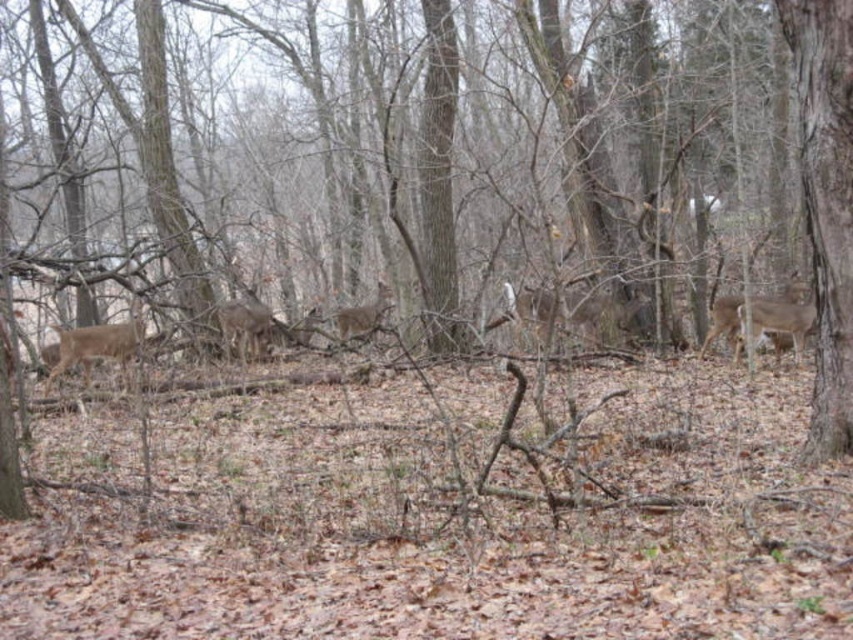
You are a hiker navigating through the wooded area and want to move from the starting point at point (x=850, y=68) to the destination at point (x=57, y=349). Based on the scene description, which direction should you head to reach your destination?

Point (x=850, y=68) is in front of point (x=57, y=349), so you should move backward to reach your destination.

You are a wildlife photographer aiming to capture both the brown fur deer at left and the brown fur deer at center in a single frame. Based on their positions, which deer would require you to adjust your camera angle more to include in the shot?

The brown fur deer at left might be wider than brown fur deer at center, so you might need to adjust your camera angle more to include the brown fur deer at left in the shot.